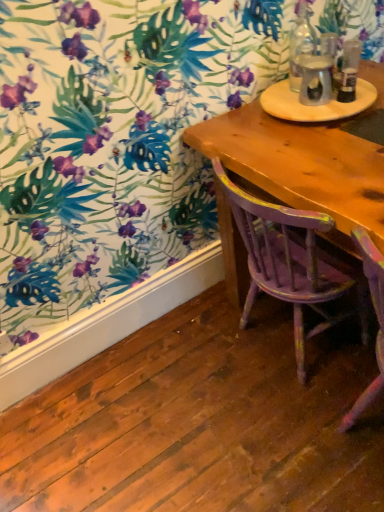
Question: Is point (354, 93) closer or farther from the camera than point (311, 232)?

Choices:
 (A) closer
 (B) farther

Answer: (B)

Question: Is clear glass bottle at upper right, which ranks as the 1th bottle in right-to-left order, situated inside distressed purple wood chair at center or outside?

Choices:
 (A) outside
 (B) inside

Answer: (A)

Question: Which object is positioned closest to the clear glass bottle at upper right, the 2th bottle in the left-to-right sequence?

Choices:
 (A) distressed purple wood chair at center
 (B) translucent glass bottle at upper right
 (C) clear glass bottle at upper right, the 1th bottle viewed from the left
 (D) wooden round table at upper right

Answer: (B)

Question: Based on their relative distances, which object is nearer to the clear glass bottle at upper right, the 1th bottle viewed from the left?

Choices:
 (A) clear glass bottle at upper right, which ranks as the 1th bottle in right-to-left order
 (B) distressed purple wood chair at center
 (C) translucent glass bottle at upper right
 (D) wooden round table at upper right

Answer: (C)